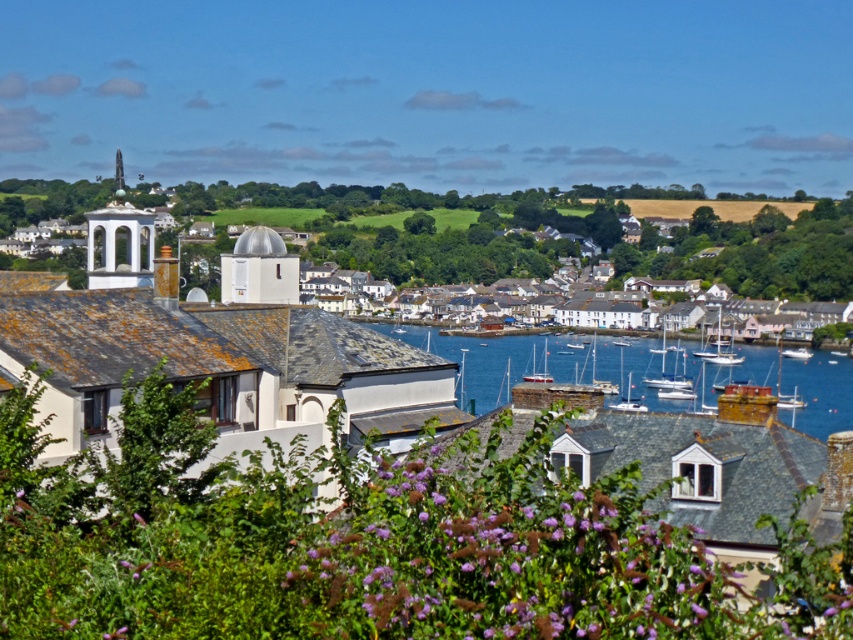
Question: In this image, where is white glossy sailboat at center located relative to white glossy boat at lower right?

Choices:
 (A) below
 (B) above

Answer: (A)

Question: Which point is farther to the camera?

Choices:
 (A) white glossy sailboat at center
 (B) blue water at center
 (C) white smooth dome at center
 (D) white glossy boat at lower right

Answer: (D)

Question: Can you confirm if white glossy boat at lower right is smaller than white glossy boat at center?

Choices:
 (A) no
 (B) yes

Answer: (A)

Question: Which of the following is the closest to the observer?

Choices:
 (A) (544, 349)
 (B) (93, 248)

Answer: (B)

Question: Which object appears farthest from the camera in this image?

Choices:
 (A) white glossy boat at center
 (B) white wooden boat at center
 (C) white sailboat at center
 (D) white stucco bell tower at upper left

Answer: (A)

Question: Is white stucco bell tower at upper left above white glossy boat at lower right?

Choices:
 (A) yes
 (B) no

Answer: (A)